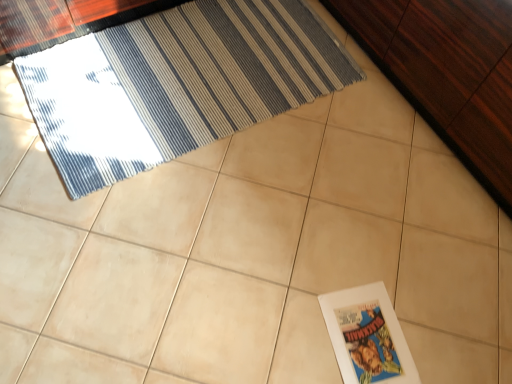
What is the approximate height of blue striped rug at upper left?

It is 4.28 centimeters.

What do you see at coordinates (367, 336) in the screenshot?
I see `white paper at lower right` at bounding box center [367, 336].

This screenshot has width=512, height=384. What are the coordinates of `blue striped rug at upper left` in the screenshot? It's located at (176, 83).

How many degrees apart are the facing directions of blue striped rug at upper left and white paper at lower right?

They differ by 166 degrees in their facing directions.

Considering the relative sizes of blue striped rug at upper left and white paper at lower right in the image provided, is blue striped rug at upper left wider than white paper at lower right?

Yes, blue striped rug at upper left is wider than white paper at lower right.

Identify the location of door on the left of white paper at lower right. (176, 83).

Who is shorter, blue striped rug at upper left or white paper at lower right?

white paper at lower right.

Considering the points (383, 367) and (73, 51), which point is in front, point (383, 367) or point (73, 51)?

The point (383, 367) is closer.

Based on the photo, from a real-world perspective, does white paper at lower right stand above blue striped rug at upper left?

No, from a real-world perspective, white paper at lower right is not over blue striped rug at upper left

Is white paper at lower right far from blue striped rug at upper left?

No, white paper at lower right is not far away from blue striped rug at upper left.

From the image's perspective, which object appears higher, dark wood dresser at upper right or white paper at lower right?

dark wood dresser at upper right.

Which object is further away from the camera taking this photo, dark wood dresser at upper right or white paper at lower right?

white paper at lower right.

From a real-world perspective, is dark wood dresser at upper right positioned over white paper at lower right based on gravity?

Indeed, from a real-world perspective, dark wood dresser at upper right stands above white paper at lower right.

Which object is further away from the camera taking this photo, dark wood dresser at upper right or blue striped rug at upper left?

Positioned behind is blue striped rug at upper left.

Considering the positions of objects dark wood dresser at upper right and blue striped rug at upper left in the image provided, who is more to the right, dark wood dresser at upper right or blue striped rug at upper left?

dark wood dresser at upper right.

From the image's perspective, is dark wood dresser at upper right beneath blue striped rug at upper left?

No.

Can you tell me how much white paper at lower right and dark wood dresser at upper right differ in facing direction?

The angle between the facing direction of white paper at lower right and the facing direction of dark wood dresser at upper right is 105 degrees.

Does white paper at lower right touch dark wood dresser at upper right?

No, white paper at lower right is not beside dark wood dresser at upper right.

Does white paper at lower right turn towards dark wood dresser at upper right?

No, white paper at lower right is not facing towards dark wood dresser at upper right.

From the image's perspective, is white paper at lower right on dark wood dresser at upper right?

No, from the image's perspective, white paper at lower right is not on top of dark wood dresser at upper right.

Is blue striped rug at upper left turned away from dark wood dresser at upper right?

That's not correct — blue striped rug at upper left is not looking away from dark wood dresser at upper right.

Which object is closer to the camera taking this photo, blue striped rug at upper left or dark wood dresser at upper right?

dark wood dresser at upper right is in front.

Are blue striped rug at upper left and dark wood dresser at upper right far apart?

That's not correct — blue striped rug at upper left is a little close to dark wood dresser at upper right.

The width and height of the screenshot is (512, 384). Identify the location of door above the white paper at lower right (from a real-world perspective). (176, 83).

The height and width of the screenshot is (384, 512). In order to click on picture frame in front of the blue striped rug at upper left in this screenshot , I will do `click(367, 336)`.

Which object lies further to the anchor point white paper at lower right, blue striped rug at upper left or dark wood dresser at upper right?

Based on the image, blue striped rug at upper left appears to be further to white paper at lower right.

Looking at the image, which one is located closer to blue striped rug at upper left, white paper at lower right or dark wood dresser at upper right?

Based on the image, dark wood dresser at upper right appears to be nearer to blue striped rug at upper left.

Looking at the image, which one is located closer to blue striped rug at upper left, dark wood dresser at upper right or white paper at lower right?

The object closer to blue striped rug at upper left is dark wood dresser at upper right.

Which object lies further to the anchor point dark wood dresser at upper right, blue striped rug at upper left or white paper at lower right?

white paper at lower right.

From the image, which object appears to be farther from white paper at lower right, dark wood dresser at upper right or blue striped rug at upper left?

blue striped rug at upper left lies further to white paper at lower right than the other object.

Based on their spatial positions, is white paper at lower right or blue striped rug at upper left further from dark wood dresser at upper right?

white paper at lower right lies further to dark wood dresser at upper right than the other object.

I want to click on picture frame between blue striped rug at upper left and dark wood dresser at upper right from left to right, so click(367, 336).